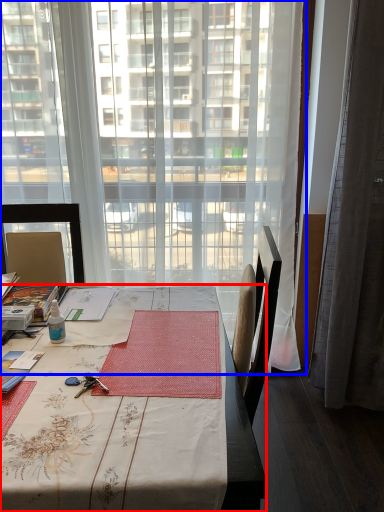
Question: Which object appears farthest to the camera in this image, desk (highlighted by a red box) or window (highlighted by a blue box)?

Choices:
 (A) desk
 (B) window

Answer: (B)